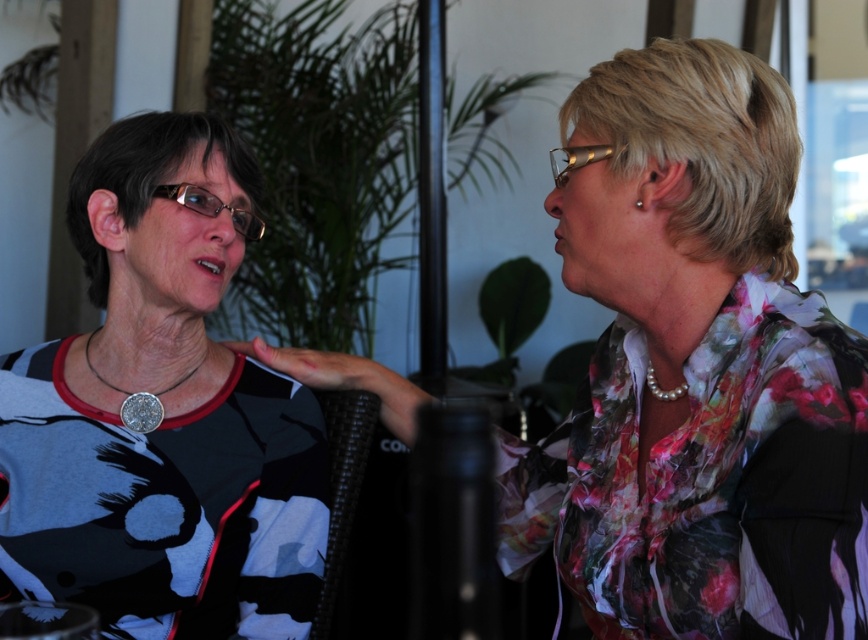
Does floral print blouse at center have a greater height compared to matte black shirt at left?

Incorrect, floral print blouse at center's height is not larger of matte black shirt at left's.

Is floral print blouse at center wider than matte black shirt at left?

Yes.

Is point (623, 541) closer to camera compared to point (156, 467)?

Yes, it is in front of point (156, 467).

You are a GUI agent. You are given a task and a screenshot of the screen. Output one action in this format:
    pyautogui.click(x=<x>, y=<y>)
    Task: Click on the floral print blouse at center
    
    Given the screenshot: What is the action you would take?
    pyautogui.click(x=695, y=371)